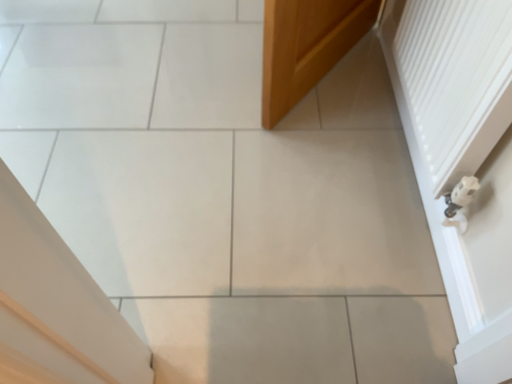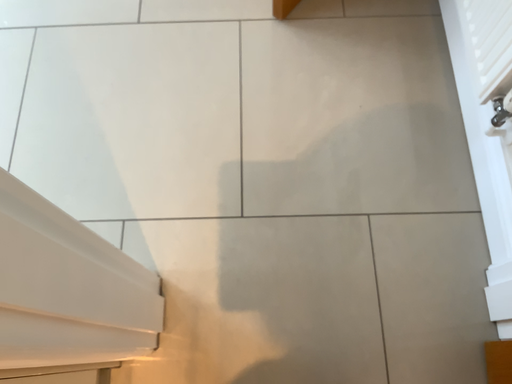
Question: Which way did the camera rotate in the video?

Choices:
 (A) rotated downward
 (B) rotated upward

Answer: (A)